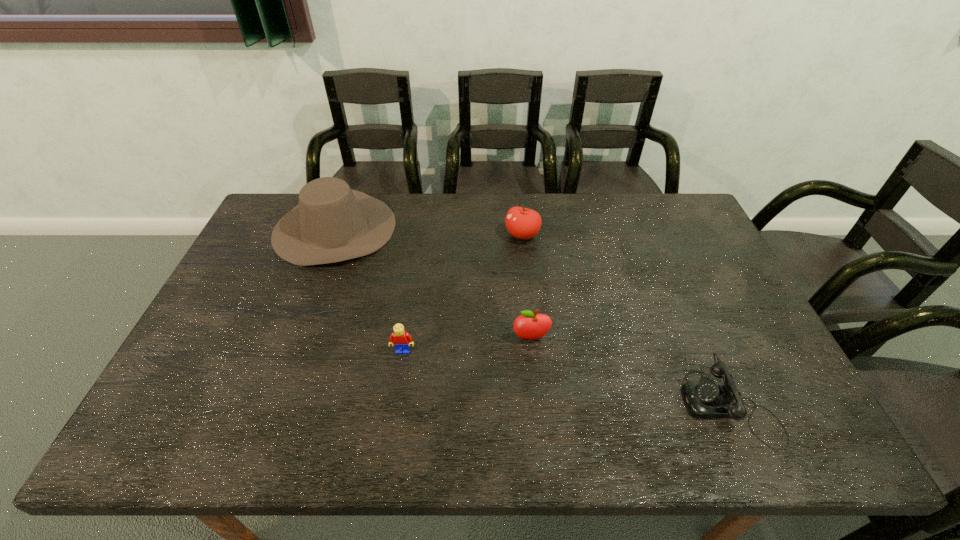
Locate an element on the screen. The image size is (960, 540). object at the far left corner is located at coordinates (332, 223).

Find the location of `object that is at the near right corner`. object that is at the near right corner is located at coordinates (707, 399).

Identify the location of free space at the far edge of the desktop. The width and height of the screenshot is (960, 540). (590, 229).

Find the location of a particular element. vacant space at the near edge is located at coordinates (521, 440).

Locate an element on the screen. The height and width of the screenshot is (540, 960). free region at the left edge is located at coordinates (239, 295).

This screenshot has height=540, width=960. In order to click on vacant space at the right edge of the desktop in this screenshot , I will do `click(765, 390)`.

Locate an element on the screen. vacant space at the far left corner of the desktop is located at coordinates (285, 200).

At what (x,y) coordinates should I click in order to perform the action: click on free spot between the farther apple and the Lego. Please return your answer as a coordinate pair (x, y). The image size is (960, 540). Looking at the image, I should click on (463, 293).

I want to click on empty location between the third farthest object and the fourth object from right to left, so click(x=468, y=344).

You are a GUI agent. You are given a task and a screenshot of the screen. Output one action in this format:
    pyautogui.click(x=<x>, y=<y>)
    Task: Click on the vacant area between the telephone and the farther apple
    
    Given the screenshot: What is the action you would take?
    pyautogui.click(x=626, y=320)